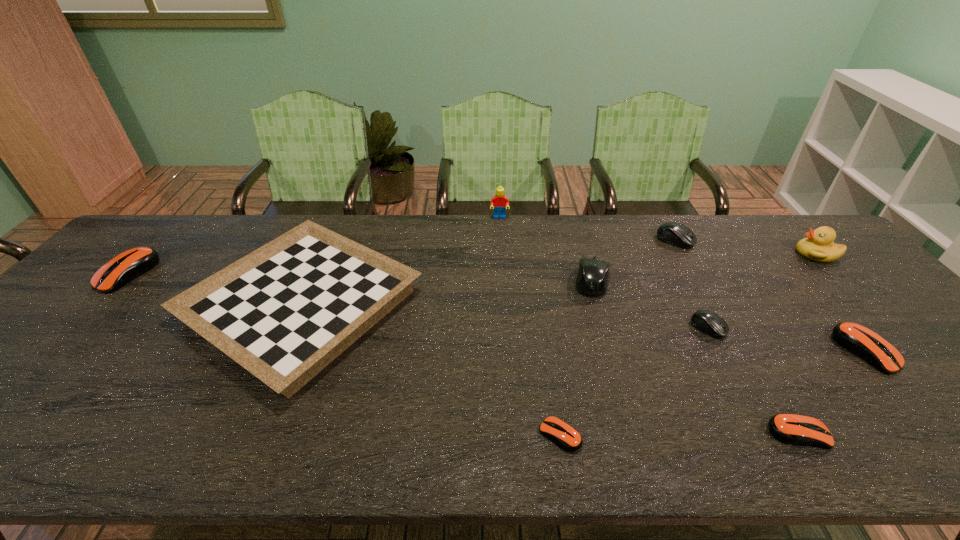
Locate an element on the screen. The width and height of the screenshot is (960, 540). free space located 0.280m on the front-facing side of the yellow duckling is located at coordinates (706, 254).

The image size is (960, 540). I want to click on vacant space situated 0.160m on the front-facing side of the yellow duckling, so click(x=745, y=254).

This screenshot has width=960, height=540. Identify the location of vacant space located on the back of the sixth object from right to left. (576, 224).

Locate an element on the screen. vacant area situated 0.180m on the left of the checkerboard is located at coordinates (116, 306).

What are the coordinates of `free spot located 0.320m on the left of the second biggest black mouse` in the screenshot? It's located at (557, 240).

At what (x,y) coordinates should I click in order to perform the action: click on vacant space located 0.330m on the front of the farthest orange computer mouse. Please return your answer as a coordinate pair (x, y). Looking at the image, I should click on (12, 397).

I want to click on vacant space situated on the left of the rightmost computer mouse, so [817, 350].

The height and width of the screenshot is (540, 960). What are the coordinates of `vacant area located on the right of the smallest black mouse` in the screenshot? It's located at (863, 328).

Identify the location of vacant space located on the left of the second shortest computer mouse. The height and width of the screenshot is (540, 960). (588, 434).

In order to click on vacant region located on the right of the sixth computer mouse from right to left in this screenshot , I will do `click(644, 435)`.